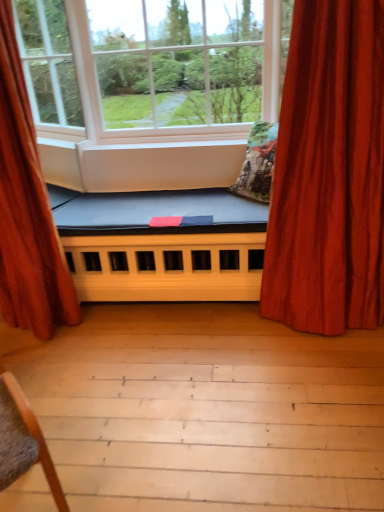
Locate an element on the screen. The width and height of the screenshot is (384, 512). vacant space situated on the left part of textured floral pillow at center is located at coordinates (203, 197).